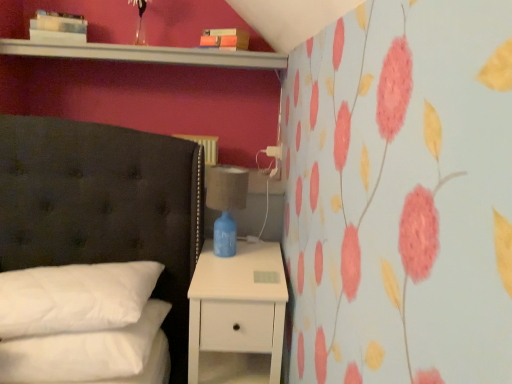
Question: Can you confirm if blue ceramic lamp at right is shorter than white soft pillow at lower left, placed as the first pillow when sorted from top to bottom?

Choices:
 (A) no
 (B) yes

Answer: (A)

Question: Considering the relative sizes of blue ceramic lamp at right and white soft pillow at lower left, acting as the second pillow starting from the bottom, in the image provided, is blue ceramic lamp at right wider than white soft pillow at lower left, acting as the second pillow starting from the bottom,?

Choices:
 (A) yes
 (B) no

Answer: (B)

Question: From a real-world perspective, is blue ceramic lamp at right on white soft pillow at lower left, placed as the first pillow when sorted from top to bottom?

Choices:
 (A) yes
 (B) no

Answer: (A)

Question: Is blue ceramic lamp at right not close to white soft pillow at lower left, placed as the first pillow when sorted from top to bottom?

Choices:
 (A) yes
 (B) no

Answer: (B)

Question: From the image's perspective, is blue ceramic lamp at right located above white soft pillow at lower left, acting as the second pillow starting from the bottom?

Choices:
 (A) yes
 (B) no

Answer: (A)

Question: Considering the positions of white soft pillow at lower left, the 2th pillow when ordered from top to bottom, and white soft pillow at lower left, placed as the first pillow when sorted from top to bottom, in the image, is white soft pillow at lower left, the 2th pillow when ordered from top to bottom, bigger or smaller than white soft pillow at lower left, placed as the first pillow when sorted from top to bottom,?

Choices:
 (A) big
 (B) small

Answer: (B)

Question: Is point (31, 380) positioned closer to the camera than point (27, 322)?

Choices:
 (A) farther
 (B) closer

Answer: (B)

Question: From the image's perspective, is white soft pillow at lower left, the 2th pillow when ordered from top to bottom, above or below white soft pillow at lower left, acting as the second pillow starting from the bottom?

Choices:
 (A) above
 (B) below

Answer: (B)

Question: Relative to white soft pillow at lower left, acting as the second pillow starting from the bottom, is white soft pillow at lower left, acting as the first pillow starting from the bottom, in front or behind?

Choices:
 (A) behind
 (B) front

Answer: (B)

Question: In terms of height, does white soft pillow at lower left, acting as the first pillow starting from the bottom, look taller or shorter compared to white matte nightstand at lower right?

Choices:
 (A) short
 (B) tall

Answer: (A)

Question: Relative to white matte nightstand at lower right, is white soft pillow at lower left, the 2th pillow when ordered from top to bottom, in front or behind?

Choices:
 (A) front
 (B) behind

Answer: (A)

Question: From a real-world perspective, is white soft pillow at lower left, acting as the first pillow starting from the bottom, positioned above or below white matte nightstand at lower right?

Choices:
 (A) below
 (B) above

Answer: (B)

Question: From the image's perspective, is white soft pillow at lower left, acting as the first pillow starting from the bottom, positioned above or below white matte nightstand at lower right?

Choices:
 (A) above
 (B) below

Answer: (A)

Question: Looking at the image, does white soft pillow at lower left, the 2th pillow when ordered from top to bottom, seem bigger or smaller compared to blue ceramic lamp at right?

Choices:
 (A) big
 (B) small

Answer: (A)

Question: From a real-world perspective, relative to blue ceramic lamp at right, is white soft pillow at lower left, acting as the first pillow starting from the bottom, vertically above or below?

Choices:
 (A) above
 (B) below

Answer: (B)